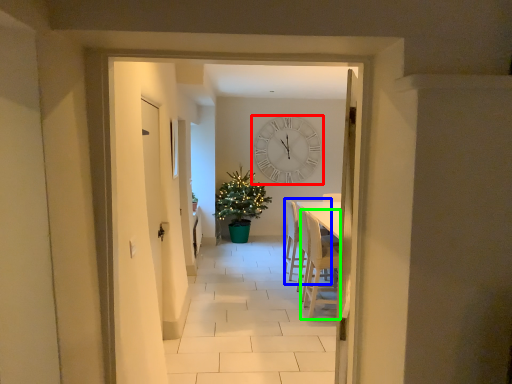
Question: Which object is positioned closest to wall clock (highlighted by a red box)? Select from armchair (highlighted by a blue box) and armchair (highlighted by a green box).

Choices:
 (A) armchair
 (B) armchair

Answer: (A)